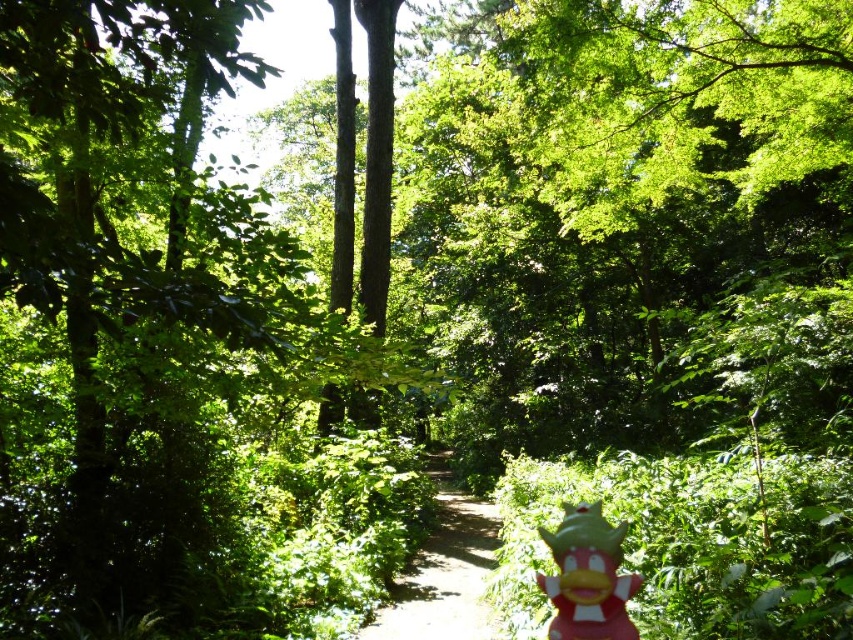
You are a hiker who wants to place a small marker exactly halfway between the dirt path at center and the rubber duck at lower right. Which object will the marker be closer to?

The dirt path at center is to the left of the rubber duck at lower right, so the marker placed halfway between them will be closer to the rubber duck at lower right because it is positioned to the right of the path.

You are a hiker who wants to pick up the rubber duck at lower right. From your current position on the dirt path at center, which direction should you move to reach it?

The rubber duck at lower right is behind the dirt path at center, so you should move backward along the dirt path at center to reach it.